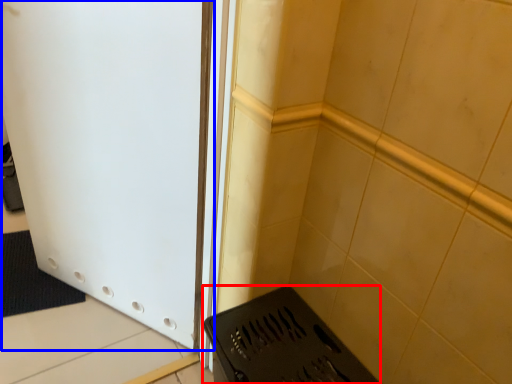
Question: Which object is closer to the camera taking this photo, appliance (highlighted by a red box) or door (highlighted by a blue box)?

Choices:
 (A) appliance
 (B) door

Answer: (B)